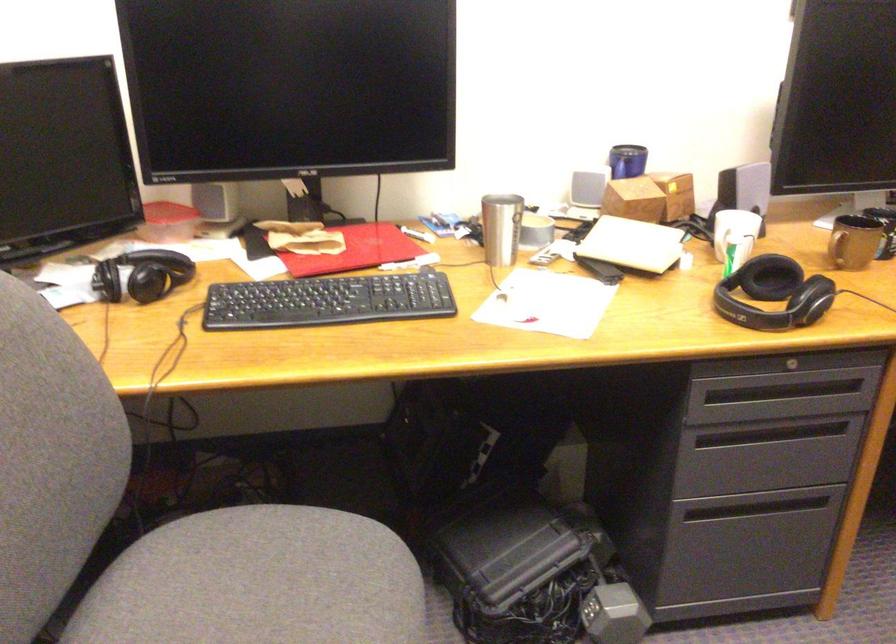
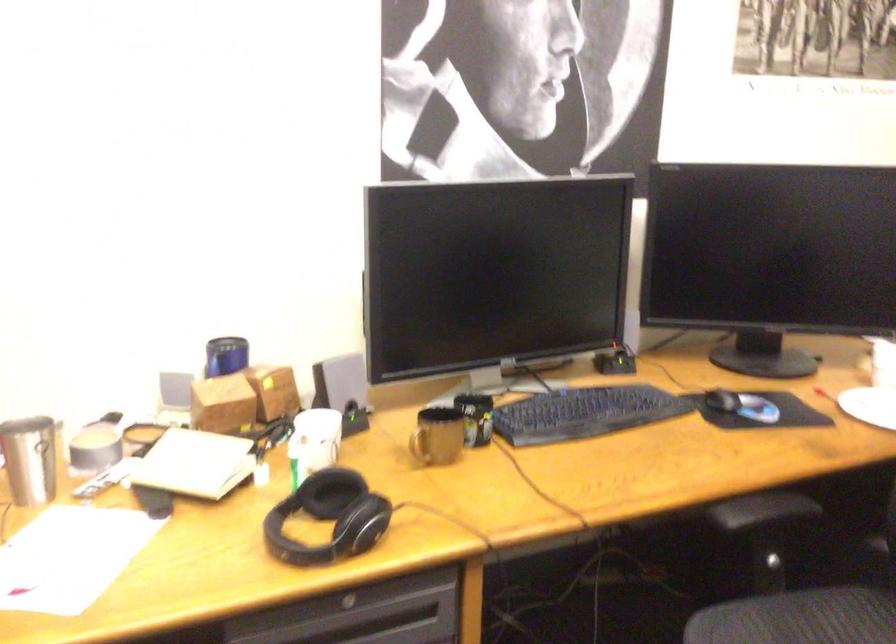
Where in the second image is the point corresponding to (633,238) from the first image?

(194, 464)